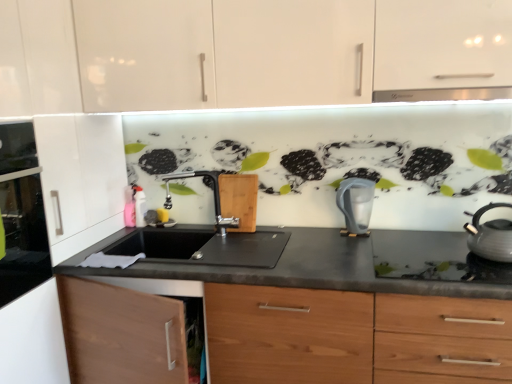
This screenshot has height=384, width=512. What do you see at coordinates (433, 258) in the screenshot? I see `white glossy gas stove at right` at bounding box center [433, 258].

The height and width of the screenshot is (384, 512). Describe the element at coordinates (213, 193) in the screenshot. I see `satin nickel faucet at center` at that location.

You are a GUI agent. You are given a task and a screenshot of the screen. Output one action in this format:
    pyautogui.click(x=<x>, y=<y>)
    Task: Click on the satin nickel faucet at center
    This screenshot has width=512, height=384.
    Given the screenshot: What is the action you would take?
    pyautogui.click(x=213, y=193)

Image resolution: width=512 pixels, height=384 pixels. Find the location of `black matte countertop at center`. black matte countertop at center is located at coordinates (334, 317).

The width and height of the screenshot is (512, 384). What do you see at coordinates (21, 214) in the screenshot?
I see `glass door oven at left` at bounding box center [21, 214].

I want to click on matte gray kettle at right, acting as the second kitchen appliance starting from the back, so click(490, 235).

How different are the orientations of satin nickel faucet at center and translucent plastic pitcher at center, positioned as the 2th kitchen appliance in right-to-left order, in degrees?

satin nickel faucet at center and translucent plastic pitcher at center, positioned as the 2th kitchen appliance in right-to-left order, are facing 0.138 degrees away from each other.

From the image's perspective, which object appears higher, satin nickel faucet at center or translucent plastic pitcher at center, which is the 2th kitchen appliance from front to back?

satin nickel faucet at center appears higher in the image.

Which is in front, point (190, 173) or point (367, 230)?

The point (367, 230) is closer.

In the scene shown: Considering the sizes of satin nickel faucet at center and translucent plastic pitcher at center, the first kitchen appliance from the back, in the image, is satin nickel faucet at center taller or shorter than translucent plastic pitcher at center, the first kitchen appliance from the back,?

Considering their sizes, satin nickel faucet at center has more height than translucent plastic pitcher at center, the first kitchen appliance from the back.

Who is taller, translucent plastic pitcher at center, positioned as the 2th kitchen appliance in right-to-left order, or black matte countertop at center?

Standing taller between the two is black matte countertop at center.

Can you tell me how much translucent plastic pitcher at center, which is the 2th kitchen appliance from front to back, and black matte countertop at center differ in facing direction?

0.909 degrees separate the facing orientations of translucent plastic pitcher at center, which is the 2th kitchen appliance from front to back, and black matte countertop at center.

Does translucent plastic pitcher at center, which is the 1th kitchen appliance from left to right, come behind black matte countertop at center?

Yes, translucent plastic pitcher at center, which is the 1th kitchen appliance from left to right, is further from the camera.

From the image's perspective, count 2nd kitchen appliances upward from the black matte countertop at center and point to it. Please provide its 2D coordinates.

[(356, 205)]

Is black matte countertop at center bigger than white glossy gas stove at right?

Correct, black matte countertop at center is larger in size than white glossy gas stove at right.

Looking at this image, is black matte countertop at center oriented towards white glossy gas stove at right?

No, black matte countertop at center is not turned towards white glossy gas stove at right.

Is black matte countertop at center taller or shorter than white glossy gas stove at right?

Considering their sizes, black matte countertop at center has more height than white glossy gas stove at right.

In terms of width, does black matte countertop at center look wider or thinner when compared to white glossy gas stove at right?

black matte countertop at center is wider than white glossy gas stove at right.

From the image's perspective, is matte gray kettle at right, acting as the second kitchen appliance starting from the back, below white glossy gas stove at right?

No.

Measure the distance from matte gray kettle at right, acting as the second kitchen appliance starting from the back, to white glossy gas stove at right.

matte gray kettle at right, acting as the second kitchen appliance starting from the back, is 10.53 inches from white glossy gas stove at right.

Between matte gray kettle at right, acting as the second kitchen appliance starting from the back, and white glossy gas stove at right, which one has larger size?

With larger size is matte gray kettle at right, acting as the second kitchen appliance starting from the back.

Considering the relative sizes of matte gray kettle at right, which is the first kitchen appliance in front-to-back order, and white glossy gas stove at right in the image provided, is matte gray kettle at right, which is the first kitchen appliance in front-to-back order, thinner than white glossy gas stove at right?

Indeed, matte gray kettle at right, which is the first kitchen appliance in front-to-back order, has a lesser width compared to white glossy gas stove at right.

Who is taller, black matte countertop at center or matte gray kettle at right, which is the first kitchen appliance in front-to-back order?

Standing taller between the two is black matte countertop at center.

Is matte gray kettle at right, acting as the second kitchen appliance starting from the left, surrounded by black matte countertop at center?

Definitely not — matte gray kettle at right, acting as the second kitchen appliance starting from the left, is not inside black matte countertop at center.

Does point (436, 330) come farther from viewer compared to point (504, 237)?

No, it is not.

Which is in front, black matte countertop at center or matte gray kettle at right, acting as the second kitchen appliance starting from the back?

black matte countertop at center is in front.

What's the angular difference between black matte countertop at center and translucent plastic pitcher at center, the first kitchen appliance from the back,'s facing directions?

0.909 degrees separate the facing orientations of black matte countertop at center and translucent plastic pitcher at center, the first kitchen appliance from the back.

Is black matte countertop at center aimed at translucent plastic pitcher at center, which is the 2th kitchen appliance from front to back?

No, black matte countertop at center is not facing towards translucent plastic pitcher at center, which is the 2th kitchen appliance from front to back.

Consider the image. From the image's perspective, which is above, black matte countertop at center or translucent plastic pitcher at center, the first kitchen appliance from the back?

translucent plastic pitcher at center, the first kitchen appliance from the back, from the image's perspective.

Considering the sizes of black matte countertop at center and translucent plastic pitcher at center, the first kitchen appliance from the back, in the image, is black matte countertop at center bigger or smaller than translucent plastic pitcher at center, the first kitchen appliance from the back,?

Clearly, black matte countertop at center is larger in size than translucent plastic pitcher at center, the first kitchen appliance from the back.

Considering the sizes of objects satin nickel faucet at center and black matte countertop at center in the image provided, who is taller, satin nickel faucet at center or black matte countertop at center?

black matte countertop at center.

Is satin nickel faucet at center surrounding black matte countertop at center?

Definitely not — black matte countertop at center is not inside satin nickel faucet at center.

Is satin nickel faucet at center to the right of black matte countertop at center from the viewer's perspective?

No.

Could you tell me if satin nickel faucet at center is facing black matte countertop at center?

No, satin nickel faucet at center is not oriented towards black matte countertop at center.

This screenshot has height=384, width=512. What are the coordinates of `kitchen appliance that is the 1st one when counting rightward from the satin nickel faucet at center` in the screenshot? It's located at (356, 205).

Identify the location of countertop to the left of translucent plastic pitcher at center, which is the 2th kitchen appliance from front to back. (334, 317).

Which object lies further to the anchor point satin nickel faucet at center, matte gray kettle at right, acting as the second kitchen appliance starting from the left, or white glossy gas stove at right?

The object further to satin nickel faucet at center is matte gray kettle at right, acting as the second kitchen appliance starting from the left.

Looking at the image, which one is located closer to glass door oven at left, translucent plastic pitcher at center, which is the 1th kitchen appliance from left to right, or matte gray kettle at right, acting as the second kitchen appliance starting from the left?

translucent plastic pitcher at center, which is the 1th kitchen appliance from left to right, lies closer to glass door oven at left than the other object.

Looking at the image, which one is located further to glass door oven at left, matte gray kettle at right, acting as the second kitchen appliance starting from the back, or black matte countertop at center?

The object further to glass door oven at left is matte gray kettle at right, acting as the second kitchen appliance starting from the back.

Which object lies further to the anchor point satin nickel faucet at center, white glossy gas stove at right or translucent plastic pitcher at center, which is the 1th kitchen appliance from left to right?

white glossy gas stove at right lies further to satin nickel faucet at center than the other object.

Which object lies nearer to the anchor point matte gray kettle at right, acting as the second kitchen appliance starting from the back, glass door oven at left or black matte countertop at center?

Based on the image, black matte countertop at center appears to be nearer to matte gray kettle at right, acting as the second kitchen appliance starting from the back.

When comparing their distances from white glossy gas stove at right, does translucent plastic pitcher at center, which is the 2th kitchen appliance from front to back, or black matte countertop at center seem further?

black matte countertop at center is positioned further to the anchor white glossy gas stove at right.

From the image, which object appears to be nearer to black matte countertop at center, white glossy gas stove at right or glass door oven at left?

The object closer to black matte countertop at center is glass door oven at left.

From the image, which object appears to be farther from matte gray kettle at right, which is the first kitchen appliance in front-to-back order, white glossy gas stove at right or translucent plastic pitcher at center, positioned as the 2th kitchen appliance in right-to-left order?

Based on the image, translucent plastic pitcher at center, positioned as the 2th kitchen appliance in right-to-left order, appears to be further to matte gray kettle at right, which is the first kitchen appliance in front-to-back order.

This screenshot has width=512, height=384. Identify the location of tap between glass door oven at left and matte gray kettle at right, the 1th kitchen appliance positioned from the right. (213, 193).

Locate an element on the screen. kitchen appliance between satin nickel faucet at center and matte gray kettle at right, the 1th kitchen appliance positioned from the right, in the horizontal direction is located at coordinates (356, 205).

The height and width of the screenshot is (384, 512). I want to click on gas stove between black matte countertop at center and translucent plastic pitcher at center, which is the 1th kitchen appliance from left to right, from front to back, so click(433, 258).

In order to click on countertop situated between glass door oven at left and white glossy gas stove at right from left to right in this screenshot , I will do click(x=334, y=317).